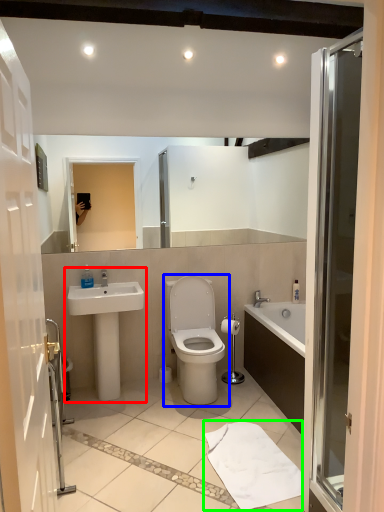
Question: Which object is the farthest from sink (highlighted by a red box)? Choose among these: toilet (highlighted by a blue box) or bath towel (highlighted by a green box).

Choices:
 (A) toilet
 (B) bath towel

Answer: (B)